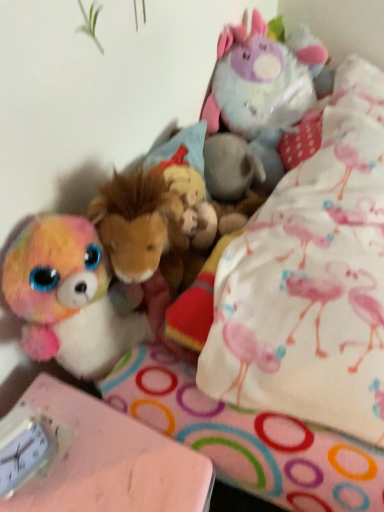
Question: Does pink matte table at lower left appear on the right side of white plastic clock at lower left?

Choices:
 (A) yes
 (B) no

Answer: (A)

Question: Can we say pink matte table at lower left lies outside white plastic clock at lower left?

Choices:
 (A) no
 (B) yes

Answer: (B)

Question: Does pink matte table at lower left have a lesser height compared to white plastic clock at lower left?

Choices:
 (A) yes
 (B) no

Answer: (B)

Question: Is pink matte table at lower left thinner than white plastic clock at lower left?

Choices:
 (A) no
 (B) yes

Answer: (A)

Question: From a real-world perspective, is pink matte table at lower left under white plastic clock at lower left?

Choices:
 (A) yes
 (B) no

Answer: (A)

Question: Is pink matte table at lower left positioned with its back to white plastic clock at lower left?

Choices:
 (A) yes
 (B) no

Answer: (B)

Question: From the image's perspective, is fluffy plush unicorn at upper right on white plastic clock at lower left?

Choices:
 (A) no
 (B) yes

Answer: (B)

Question: Does fluffy plush unicorn at upper right have a smaller size compared to white plastic clock at lower left?

Choices:
 (A) no
 (B) yes

Answer: (A)

Question: Would you say fluffy plush unicorn at upper right is a long distance from white plastic clock at lower left?

Choices:
 (A) yes
 (B) no

Answer: (B)

Question: Does fluffy plush unicorn at upper right come behind white plastic clock at lower left?

Choices:
 (A) no
 (B) yes

Answer: (B)

Question: Can you confirm if fluffy plush unicorn at upper right is wider than white plastic clock at lower left?

Choices:
 (A) yes
 (B) no

Answer: (A)

Question: Is fluffy plush unicorn at upper right located outside white plastic clock at lower left?

Choices:
 (A) yes
 (B) no

Answer: (A)

Question: Does fluffy plush unicorn at upper right have a smaller size compared to pink matte table at lower left?

Choices:
 (A) no
 (B) yes

Answer: (B)